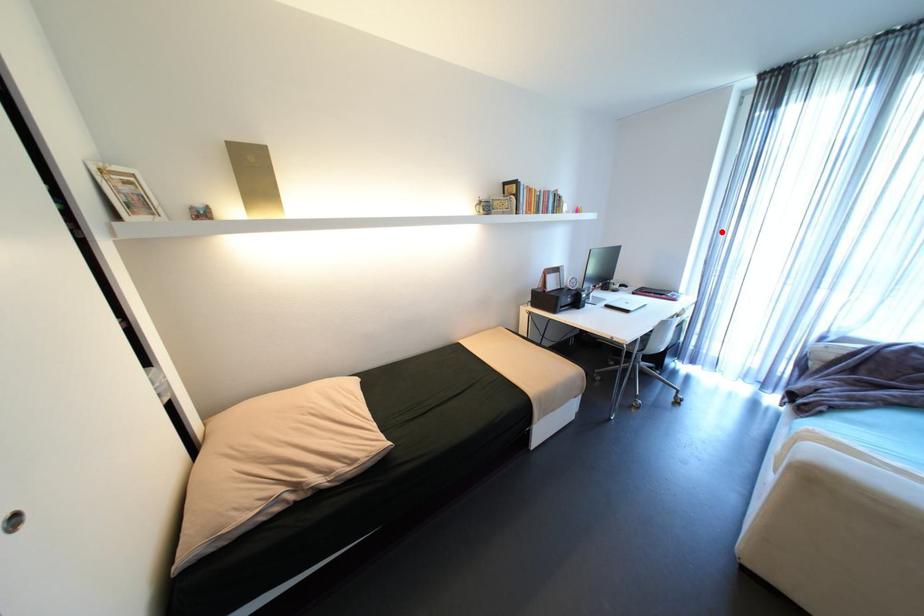
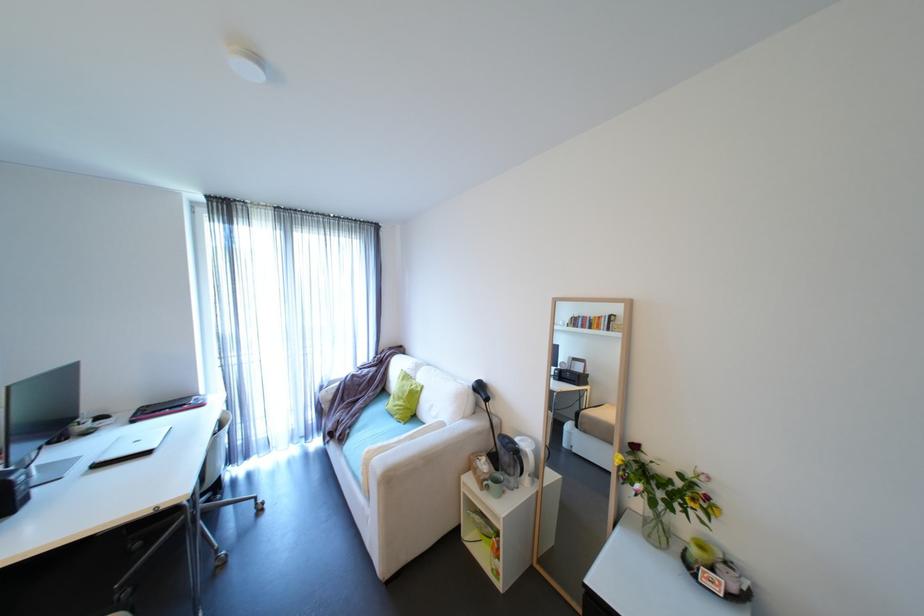
The point at the highlighted location is marked in the first image. Where is the corresponding point in the second image?

(225, 326)